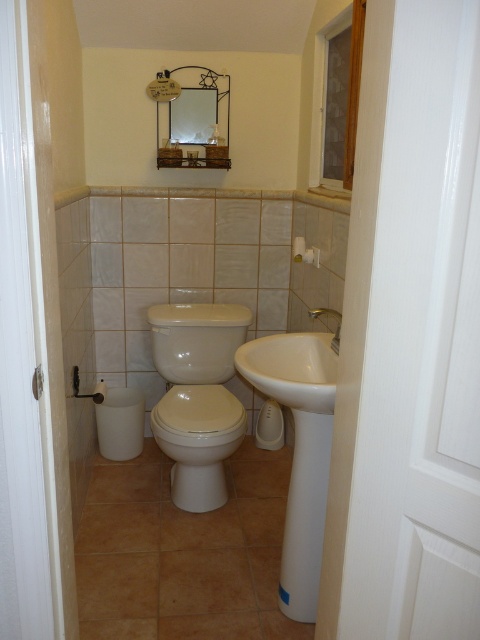
Is white ceramic sink at center above silver metallic faucet at upper right?

No, white ceramic sink at center is not above silver metallic faucet at upper right.

Between point (251, 358) and point (326, 307), which one is positioned in front?

Point (251, 358)

Locate an element on the screen. The width and height of the screenshot is (480, 640). white ceramic sink at center is located at coordinates (299, 451).

Image resolution: width=480 pixels, height=640 pixels. I want to click on white ceramic sink at center, so click(x=299, y=451).

Between point (223, 449) and point (336, 344), which one is positioned behind?

The point (223, 449) is behind.

This screenshot has width=480, height=640. What are the coordinates of `white glossy toilet at center` in the screenshot? It's located at (197, 442).

Is point (216, 435) in front of point (314, 317)?

Yes, it is in front of point (314, 317).

You are a GUI agent. You are given a task and a screenshot of the screen. Output one action in this format:
    pyautogui.click(x=<x>, y=<y>)
    Task: Click on the white glossy toilet at center
    
    Given the screenshot: What is the action you would take?
    pyautogui.click(x=197, y=442)

Is white ceramic sink at center wider than white glossy toilet at center?

In fact, white ceramic sink at center might be narrower than white glossy toilet at center.

Can you confirm if white ceramic sink at center is shorter than white glossy toilet at center?

No, white ceramic sink at center is not shorter than white glossy toilet at center.

Is point (294, 417) in front of point (216, 480)?

Yes, point (294, 417) is in front of point (216, 480).

Identify the location of white ceramic sink at center. click(x=299, y=451).